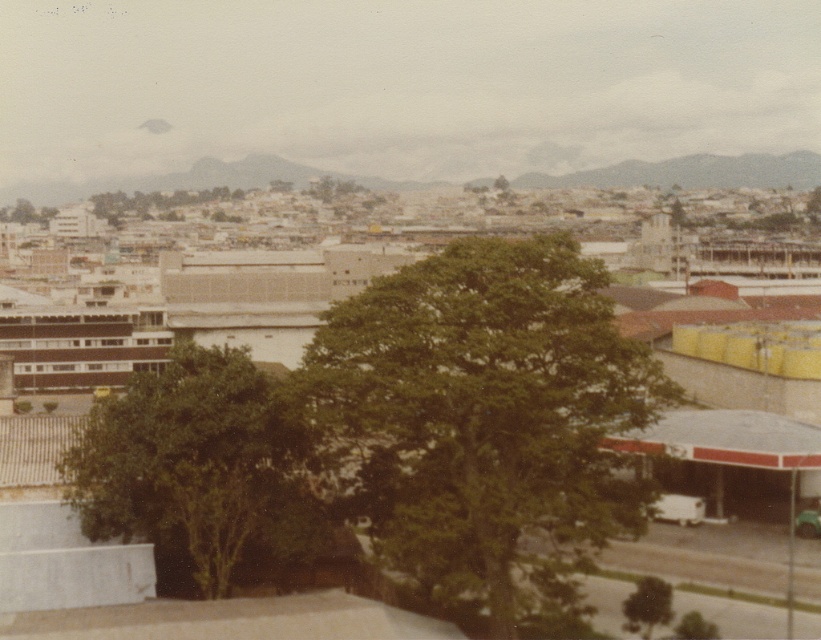
Is green leafy tree at lower right thinner than green leafy tree at lower center?

In fact, green leafy tree at lower right might be wider than green leafy tree at lower center.

Identify the location of green leafy tree at lower right. (647, 605).

Find the location of a particular element. This screenshot has width=821, height=640. green leafy tree at lower right is located at coordinates (647, 605).

The width and height of the screenshot is (821, 640). I want to click on green leafy tree at lower right, so click(x=647, y=605).

Which of these two, green leafy tree at center or green leafy tree at lower right, stands taller?

green leafy tree at center

Is point (599, 305) more distant than point (650, 589)?

No, it is not.

This screenshot has width=821, height=640. In order to click on green leafy tree at center in this screenshot , I will do `click(487, 422)`.

Is point (480, 477) farther from camera compared to point (159, 435)?

No, (480, 477) is closer to viewer.

Between green leafy tree at center and green leafy tree at center-left, which one appears on the right side from the viewer's perspective?

From the viewer's perspective, green leafy tree at center appears more on the right side.

Is point (471, 468) behind point (158, 534)?

No, (471, 468) is in front of (158, 534).

The image size is (821, 640). In order to click on green leafy tree at center in this screenshot , I will do `click(487, 422)`.